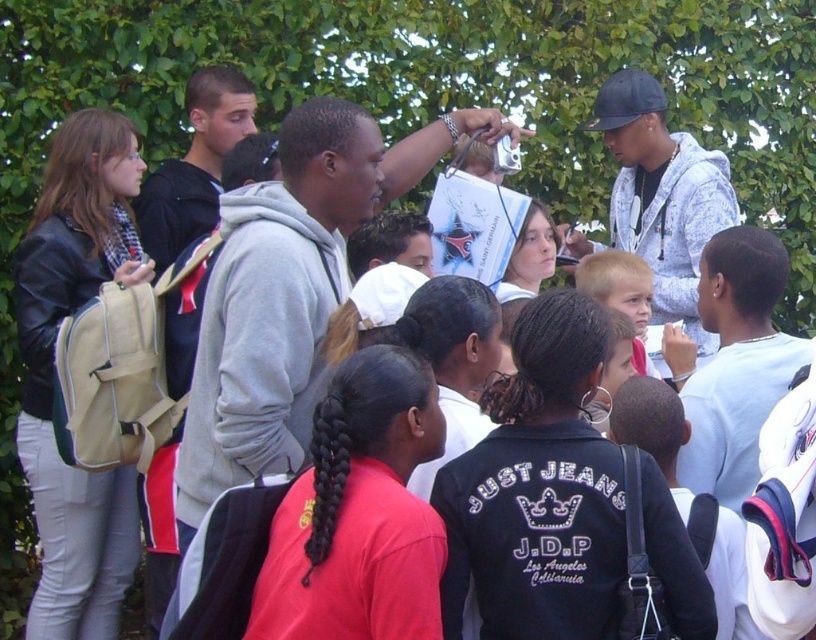
Question: Among these points, which one is nearest to the camera?

Choices:
 (A) (460, 502)
 (B) (42, 596)

Answer: (A)

Question: Where is black leather jacket at center located in relation to leather jacket at left in the image?

Choices:
 (A) left
 (B) right

Answer: (B)

Question: Is black leather jacket at center above leather jacket at left?

Choices:
 (A) yes
 (B) no

Answer: (B)

Question: Which point is closer to the camera taking this photo?

Choices:
 (A) (43, 492)
 (B) (581, 348)

Answer: (B)

Question: Which point appears farthest from the camera in this image?

Choices:
 (A) (109, 260)
 (B) (517, 532)

Answer: (A)

Question: Can you confirm if black leather jacket at center is wider than leather jacket at left?

Choices:
 (A) no
 (B) yes

Answer: (B)